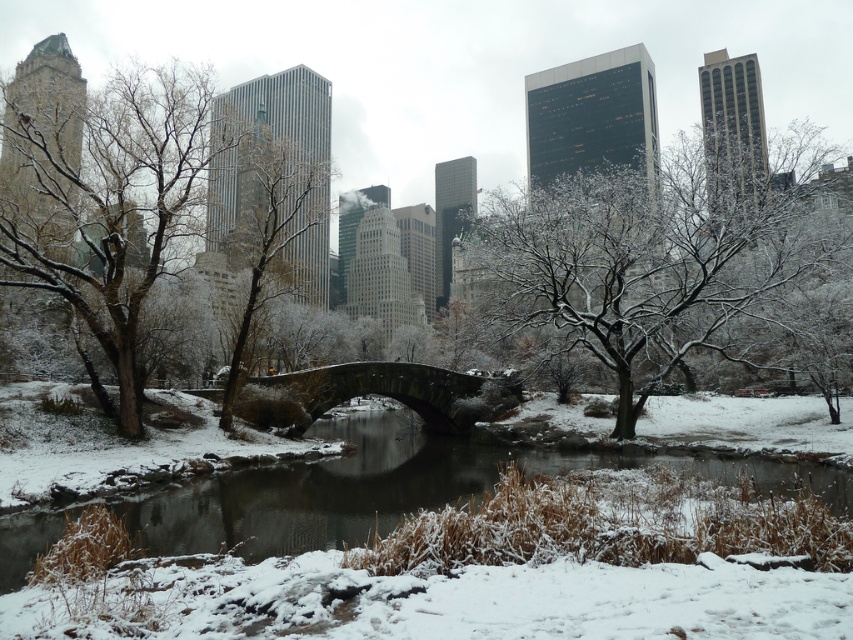
You are standing at point (x=399, y=486) in the winter scene. What object are you standing on?

You are standing on the snowy concrete bridge at center located at point (x=399, y=486).

You are a photographer planning to take a picture of the Gapstow Bridge in Central Park. You notice two points marked in the image at coordinates point (704, 216) and point (126, 346). If you want to ensure both points are visible in your photo, which point should be closer to the camera to avoid being blocked by the other?

Point (126, 346) should be closer to the camera because point (704, 216) is behind it, so positioning the camera so that point (126, 346) is in front will ensure both are visible without obstruction.